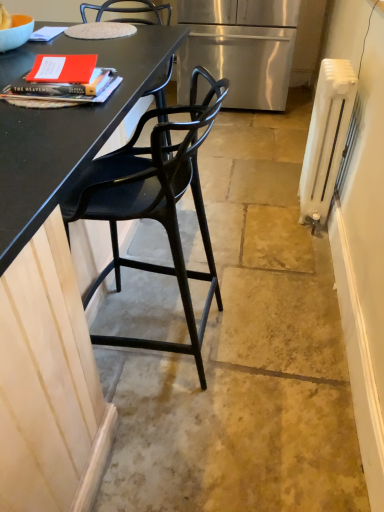
Question: Can you confirm if white painted metal radiator at right is smaller than black matte chair at left?

Choices:
 (A) yes
 (B) no

Answer: (A)

Question: Does white painted metal radiator at right contain black matte chair at left?

Choices:
 (A) yes
 (B) no

Answer: (B)

Question: Is the depth of white painted metal radiator at right greater than that of black matte chair at left?

Choices:
 (A) yes
 (B) no

Answer: (A)

Question: Can you confirm if white painted metal radiator at right is positioned to the left of black matte chair at left?

Choices:
 (A) yes
 (B) no

Answer: (B)

Question: From the image's perspective, is white painted metal radiator at right under black matte chair at left?

Choices:
 (A) no
 (B) yes

Answer: (A)

Question: Based on their sizes in the image, would you say stainless steel refrigerator at center is bigger or smaller than white painted metal radiator at right?

Choices:
 (A) small
 (B) big

Answer: (B)

Question: Considering the positions of stainless steel refrigerator at center and white painted metal radiator at right in the image, is stainless steel refrigerator at center taller or shorter than white painted metal radiator at right?

Choices:
 (A) short
 (B) tall

Answer: (B)

Question: Is point (213, 75) positioned closer to the camera than point (327, 140)?

Choices:
 (A) farther
 (B) closer

Answer: (A)

Question: Would you say stainless steel refrigerator at center is inside or outside white painted metal radiator at right?

Choices:
 (A) inside
 (B) outside

Answer: (B)

Question: Is stainless steel refrigerator at center in front of or behind black matte chair at left in the image?

Choices:
 (A) front
 (B) behind

Answer: (B)

Question: From the image's perspective, is stainless steel refrigerator at center positioned above or below black matte chair at left?

Choices:
 (A) below
 (B) above

Answer: (B)

Question: In terms of width, does stainless steel refrigerator at center look wider or thinner when compared to black matte chair at left?

Choices:
 (A) thin
 (B) wide

Answer: (B)

Question: From their relative heights in the image, would you say stainless steel refrigerator at center is taller or shorter than black matte chair at left?

Choices:
 (A) short
 (B) tall

Answer: (A)

Question: Looking at their shapes, would you say white painted metal radiator at right is wider or thinner than stainless steel refrigerator at center?

Choices:
 (A) wide
 (B) thin

Answer: (B)

Question: Is white painted metal radiator at right bigger or smaller than stainless steel refrigerator at center?

Choices:
 (A) big
 (B) small

Answer: (B)